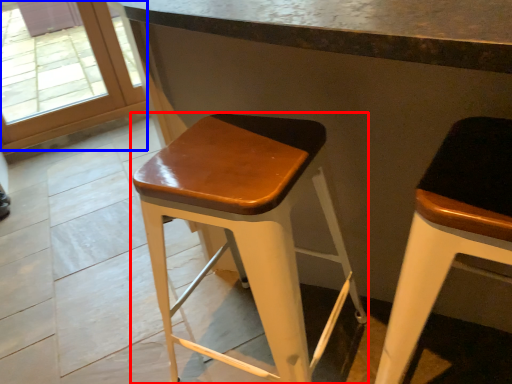
Question: Which object appears farthest to the camera in this image, stool (highlighted by a red box) or glass door (highlighted by a blue box)?

Choices:
 (A) stool
 (B) glass door

Answer: (B)